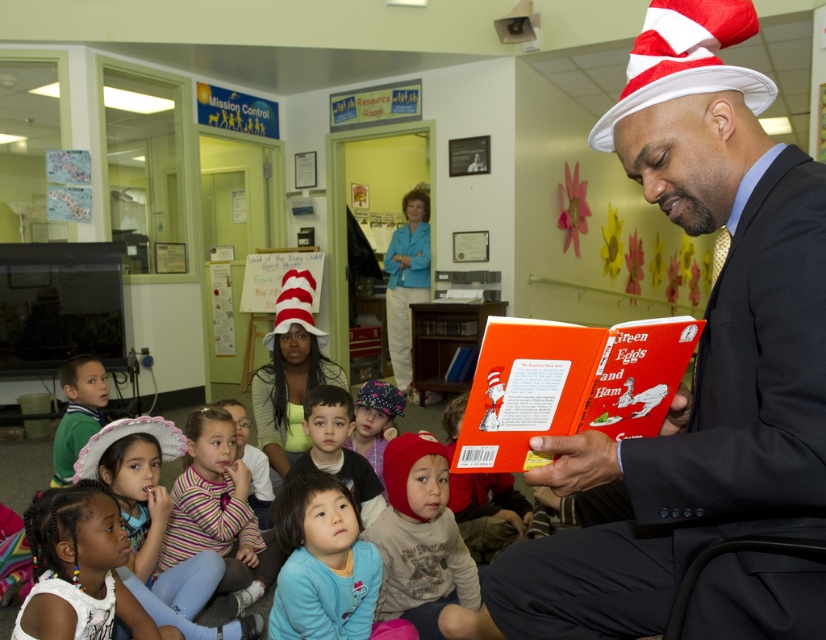
Question: Is orange paper book at center positioned before plush pink hat at center?

Choices:
 (A) yes
 (B) no

Answer: (A)

Question: Which of these objects is positioned farthest from the striped sweater at center?

Choices:
 (A) red knit hat at lower center
 (B) green cotton shirt at lower left
 (C) plush pink hat at center

Answer: (B)

Question: Does smooth skin girl at lower left appear over white striped fabric hat at center?

Choices:
 (A) no
 (B) yes

Answer: (A)

Question: Does matte black suit at center have a greater width compared to white striped fabric hat at center?

Choices:
 (A) yes
 (B) no

Answer: (A)

Question: Among these points, which one is nearest to the camera?

Choices:
 (A) (84, 371)
 (B) (468, 561)
 (C) (786, 349)
 (D) (369, 435)

Answer: (C)

Question: Estimate the real-world distances between objects in this image. Which object is closer to the white/red striped hat at upper right?

Choices:
 (A) orange paper book at center
 (B) white striped fabric hat at center

Answer: (A)